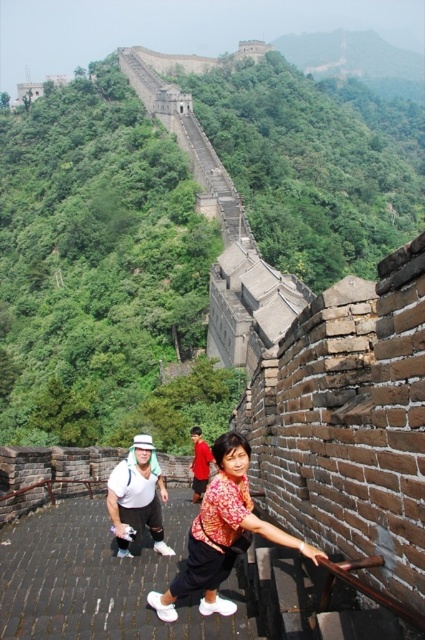
You are a photographer positioned at the base of the Great Wall. You notice two items in your viewfinder, the white matte hat at upper center and the red shirt at center. Which object appears wider in your frame?

The white matte hat at upper center appears wider in the frame as its width surpasses that of the red shirt at center.

In the scene shown: You are a tour guide leading a group on the Great Wall and need to ensure everyone stays within a safe distance of 50 feet. You notice two tourists wearing red clothing. One is wearing a matte red blouse at center and the other is wearing a red shirt at center. Are these two tourists within the required safe distance?

The distance between the matte red blouse at center and the red shirt at center is 62.10 feet, which exceeds the 50 feet safe distance requirement. Therefore, the tourists are not within the required safe distance.

You are standing at the base of the Great Wall and want to take a photo. There are two points marked on the wall at coordinates point (x=132, y=481) and point (x=195, y=496). Which point will appear larger in your camera view?

Point (x=132, y=481) is closer to the camera than point (x=195, y=496), so it will appear larger in the camera view.